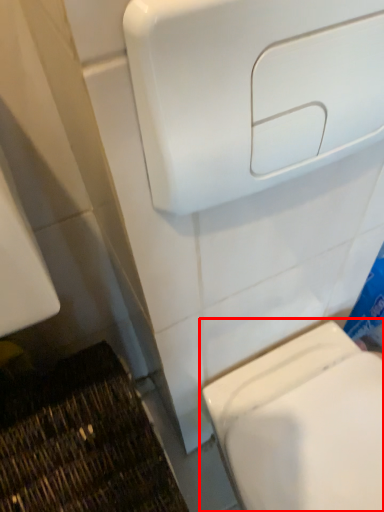
Question: From the image's perspective, what is the correct spatial relationship of toilet (annotated by the red box) in relation to hand dryer?

Choices:
 (A) below
 (B) above

Answer: (A)